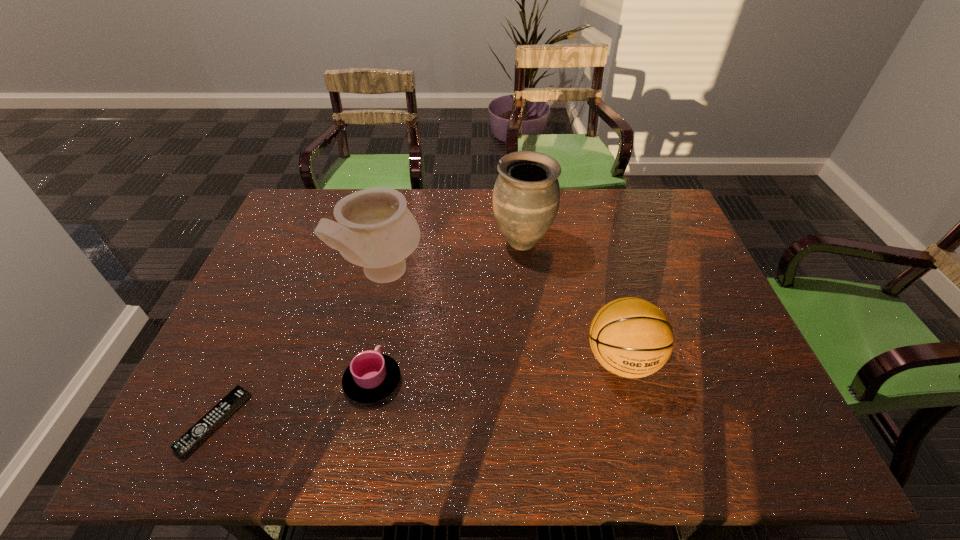
This screenshot has height=540, width=960. In the image, there is a desktop. In order to click on vacant space at the far left corner in this screenshot , I will do `click(324, 202)`.

Locate an element on the screen. free space at the far right corner of the desktop is located at coordinates (661, 199).

Locate an element on the screen. The image size is (960, 540). vacant space that is in between the third tallest object and the remote control is located at coordinates (418, 391).

Identify the location of vacant area that lies between the pottery and the shortest object. This screenshot has width=960, height=540. (299, 348).

The width and height of the screenshot is (960, 540). Find the location of `blank region between the cup and the basketball`. blank region between the cup and the basketball is located at coordinates (497, 370).

The height and width of the screenshot is (540, 960). Identify the location of free spot between the remote control and the basketball. (418, 391).

Find the location of a particular element. free point between the second shortest object and the rightmost object is located at coordinates (497, 370).

In order to click on free space that is in between the cup and the pottery in this screenshot , I will do click(377, 327).

Locate an element on the screen. This screenshot has width=960, height=540. vacant space in between the fourth tallest object and the pottery is located at coordinates (377, 327).

Where is `vacant space that's between the remote control and the cup`? The image size is (960, 540). vacant space that's between the remote control and the cup is located at coordinates (294, 401).